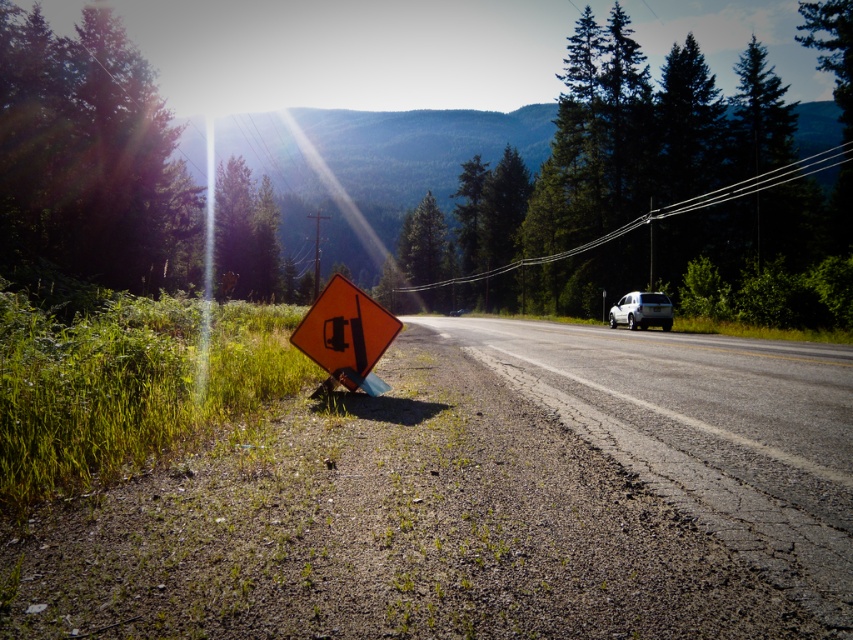
Is point (372, 316) in front of point (844, 160)?

Yes, it is.

Is orange reflective diamond-shaped sign at center-left thinner than metallic wire at upper center?

Indeed, orange reflective diamond-shaped sign at center-left has a lesser width compared to metallic wire at upper center.

Identify the location of orange reflective diamond-shaped sign at center-left. [346, 333].

Identify the location of orange reflective diamond-shaped sign at center-left. (346, 333).

Which is below, asphalt road at center or orange reflective diamond-shaped sign at center-left?

asphalt road at center

What do you see at coordinates (705, 433) in the screenshot? This screenshot has height=640, width=853. I see `asphalt road at center` at bounding box center [705, 433].

Identify the location of asphalt road at center. This screenshot has height=640, width=853. (705, 433).

Is point (370, 358) in front of point (642, 301)?

Yes, point (370, 358) is closer to viewer.

Consider the image. Is orange reflective diamond-shaped sign at center-left bigger than white matte suv at center-right?

Incorrect, orange reflective diamond-shaped sign at center-left is not larger than white matte suv at center-right.

Which is behind, point (380, 328) or point (663, 326)?

Positioned behind is point (663, 326).

This screenshot has height=640, width=853. Find the location of `orange reflective diamond-shaped sign at center-left`. orange reflective diamond-shaped sign at center-left is located at coordinates click(346, 333).